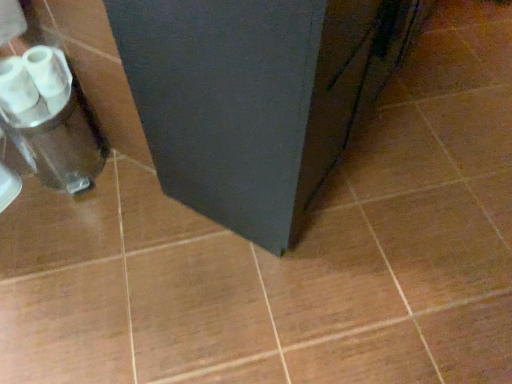
Question: Is matte black cabinet at center at the right side of silver metallic blender at left?

Choices:
 (A) yes
 (B) no

Answer: (A)

Question: Does matte black cabinet at center have a greater width compared to silver metallic blender at left?

Choices:
 (A) yes
 (B) no

Answer: (A)

Question: Considering the relative sizes of matte black cabinet at center and silver metallic blender at left in the image provided, is matte black cabinet at center thinner than silver metallic blender at left?

Choices:
 (A) yes
 (B) no

Answer: (B)

Question: Is matte black cabinet at center facing away from silver metallic blender at left?

Choices:
 (A) yes
 (B) no

Answer: (A)

Question: Is matte black cabinet at center beside silver metallic blender at left?

Choices:
 (A) yes
 (B) no

Answer: (B)

Question: Is matte black cabinet at center bigger than silver metallic blender at left?

Choices:
 (A) yes
 (B) no

Answer: (A)

Question: From a real-world perspective, does matte black cabinet at center stand above white glossy toilet paper at left?

Choices:
 (A) no
 (B) yes

Answer: (B)

Question: From the image's perspective, is matte black cabinet at center located above white glossy toilet paper at left?

Choices:
 (A) no
 (B) yes

Answer: (B)

Question: Is matte black cabinet at center further to camera compared to white glossy toilet paper at left?

Choices:
 (A) no
 (B) yes

Answer: (A)

Question: Is matte black cabinet at center at the left side of white glossy toilet paper at left?

Choices:
 (A) no
 (B) yes

Answer: (A)

Question: From a real-world perspective, is matte black cabinet at center beneath white glossy toilet paper at left?

Choices:
 (A) no
 (B) yes

Answer: (A)

Question: Can you confirm if matte black cabinet at center is thinner than white glossy toilet paper at left?

Choices:
 (A) no
 (B) yes

Answer: (A)

Question: Is white glossy toilet paper at left positioned beyond the bounds of matte black cabinet at center?

Choices:
 (A) yes
 (B) no

Answer: (A)